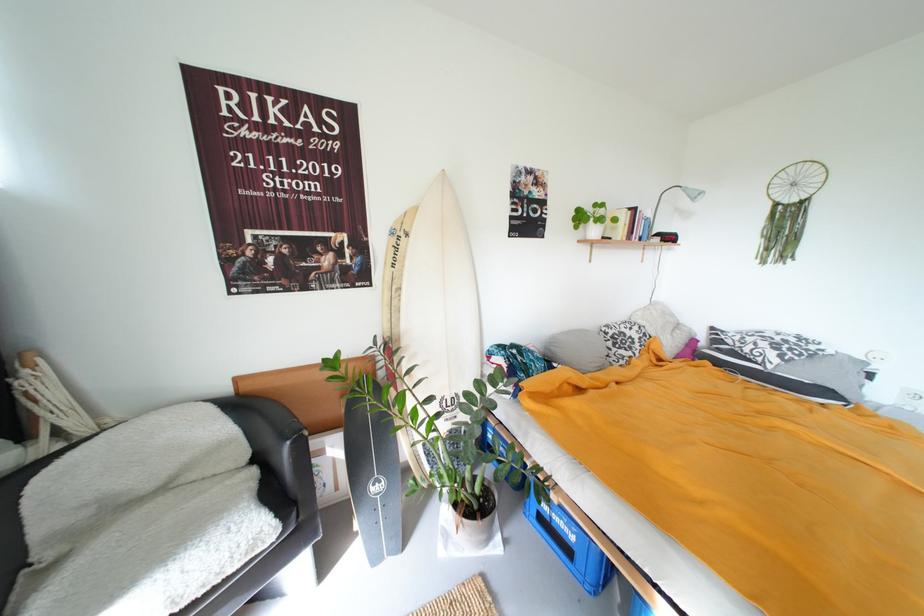
I want to click on chair sitting surface, so click(x=126, y=525).